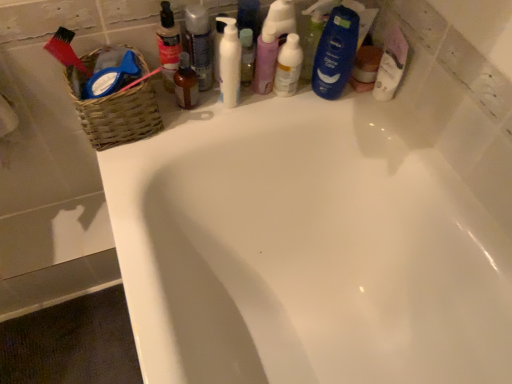
In order to click on vacant space to the right of translucent plastic bottle at upper center, which is the 1th toiletry in left-to-right order in this screenshot , I will do `click(238, 110)`.